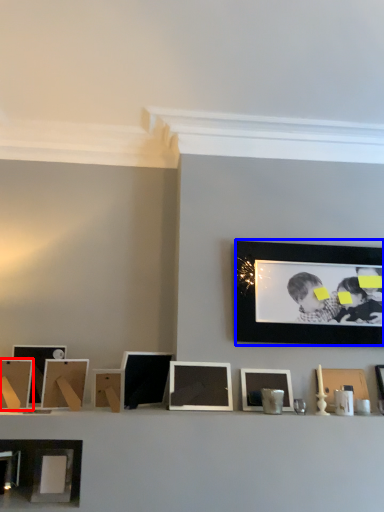
Question: Which point is closer to the camera, picture frame (highlighted by a red box) or picture frame (highlighted by a blue box)?

Choices:
 (A) picture frame
 (B) picture frame

Answer: (A)